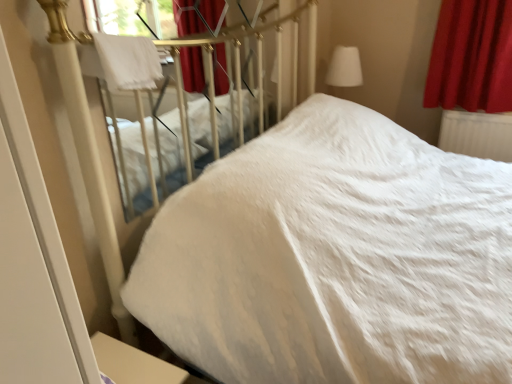
Find the location of a particular element. Image resolution: width=512 pixels, height=384 pixels. velvet red curtain at upper right is located at coordinates (472, 57).

What is the approximate width of white fabric lampshade at upper right?

white fabric lampshade at upper right is 28.93 centimeters wide.

This screenshot has width=512, height=384. What are the coordinates of `white soft bed at center, which appears as the second bed when viewed from the left` in the screenshot? It's located at (334, 258).

The height and width of the screenshot is (384, 512). Find the location of `white glossy screen door at lower left`. white glossy screen door at lower left is located at coordinates (38, 253).

Could you tell me if white soft bed at upper left, the second bed viewed from the right, is turned towards white soft bed at center, which appears as the second bed when viewed from the left?

Yes, white soft bed at upper left, the second bed viewed from the right, is turned towards white soft bed at center, which appears as the second bed when viewed from the left.

In terms of size, does white soft bed at upper left, which appears as the 1th bed when viewed from the left, appear bigger or smaller than white soft bed at center, the first bed in the right-to-left sequence?

Clearly, white soft bed at upper left, which appears as the 1th bed when viewed from the left, is smaller in size than white soft bed at center, the first bed in the right-to-left sequence.

Looking at this image, is white soft bed at upper left, which appears as the 1th bed when viewed from the left, to the left of white soft bed at center, the first bed in the right-to-left sequence, from the viewer's perspective?

Yes, white soft bed at upper left, which appears as the 1th bed when viewed from the left, is to the left of white soft bed at center, the first bed in the right-to-left sequence.

Which is more to the left, white soft bed at center, which appears as the second bed when viewed from the left, or white fluffy blanket at upper left?

white fluffy blanket at upper left.

Is white soft bed at center, the first bed in the right-to-left sequence, closer to the viewer compared to white fluffy blanket at upper left?

Yes, the depth of white soft bed at center, the first bed in the right-to-left sequence, is less than that of white fluffy blanket at upper left.

Which object is thinner, white soft bed at center, which appears as the second bed when viewed from the left, or white fluffy blanket at upper left?

Thinner between the two is white fluffy blanket at upper left.

Is white soft bed at center, which appears as the second bed when viewed from the left, looking in the opposite direction of white fluffy blanket at upper left?

That's right, white soft bed at center, which appears as the second bed when viewed from the left, is facing away from white fluffy blanket at upper left.

How distant is white soft bed at center, the first bed in the right-to-left sequence, from white soft bed at upper left, which appears as the 1th bed when viewed from the left?

The distance of white soft bed at center, the first bed in the right-to-left sequence, from white soft bed at upper left, which appears as the 1th bed when viewed from the left, is 27.78 inches.

From a real-world perspective, is white soft bed at center, which appears as the second bed when viewed from the left, beneath white soft bed at upper left, the second bed viewed from the right?

Yes, from a real-world perspective, white soft bed at center, which appears as the second bed when viewed from the left, is under white soft bed at upper left, the second bed viewed from the right.

Is white soft bed at center, which appears as the second bed when viewed from the left, thinner than white soft bed at upper left, which appears as the 1th bed when viewed from the left?

No.

Between white soft bed at center, the first bed in the right-to-left sequence, and white soft bed at upper left, which appears as the 1th bed when viewed from the left, which one has more height?

With more height is white soft bed at center, the first bed in the right-to-left sequence.

Considering the sizes of white soft bed at center, the first bed in the right-to-left sequence, and white plastic radiator at right in the image, is white soft bed at center, the first bed in the right-to-left sequence, wider or thinner than white plastic radiator at right?

Clearly, white soft bed at center, the first bed in the right-to-left sequence, has more width compared to white plastic radiator at right.

From a real-world perspective, is white soft bed at center, which appears as the second bed when viewed from the left, on white plastic radiator at right?

Yes, from a real-world perspective, white soft bed at center, which appears as the second bed when viewed from the left, is on top of white plastic radiator at right.

Relative to white plastic radiator at right, is white soft bed at center, the first bed in the right-to-left sequence, in front or behind?

white soft bed at center, the first bed in the right-to-left sequence, is in front of white plastic radiator at right.

Based on their positions, is white soft bed at center, the first bed in the right-to-left sequence, located to the left or right of white plastic radiator at right?

Clearly, white soft bed at center, the first bed in the right-to-left sequence, is on the left of white plastic radiator at right in the image.

Looking at this image, what's the angular difference between white fabric lampshade at upper right and white plastic radiator at right's facing directions?

The angular difference between white fabric lampshade at upper right and white plastic radiator at right is 88.6 degrees.

Could white plastic radiator at right be considered to be inside white fabric lampshade at upper right?

No, white fabric lampshade at upper right does not contain white plastic radiator at right.

You are a GUI agent. You are given a task and a screenshot of the screen. Output one action in this format:
    pyautogui.click(x=<x>, y=<y>)
    Task: Click on the table lamp above the white plastic radiator at right (from the image's perspective)
    This screenshot has width=512, height=384.
    Given the screenshot: What is the action you would take?
    pyautogui.click(x=345, y=67)

Can you confirm if white fabric lampshade at upper right is shorter than white plastic radiator at right?

Incorrect, the height of white fabric lampshade at upper right does not fall short of that of white plastic radiator at right.

Between white plastic radiator at right and white glossy screen door at lower left, which one has smaller size?

Smaller between the two is white glossy screen door at lower left.

Measure the distance between white plastic radiator at right and white glossy screen door at lower left.

white plastic radiator at right and white glossy screen door at lower left are 8.36 feet apart.

How different are the orientations of white plastic radiator at right and white glossy screen door at lower left in degrees?

88.3 degrees.

Is white plastic radiator at right spatially inside white glossy screen door at lower left, or outside of it?

white plastic radiator at right is not inside white glossy screen door at lower left, it's outside.

Is there a large distance between velvet red curtain at upper right and white soft bed at center, the first bed in the right-to-left sequence?

That's right, there is a large distance between velvet red curtain at upper right and white soft bed at center, the first bed in the right-to-left sequence.

Is velvet red curtain at upper right in front of white soft bed at center, the first bed in the right-to-left sequence?

No, the depth of velvet red curtain at upper right is greater than that of white soft bed at center, the first bed in the right-to-left sequence.

Is point (424, 98) closer or farther from the camera than point (389, 127)?

Point (424, 98).

Where is `bed that appears on the right of white soft bed at upper left, which appears as the 1th bed when viewed from the left`? The height and width of the screenshot is (384, 512). bed that appears on the right of white soft bed at upper left, which appears as the 1th bed when viewed from the left is located at coordinates (334, 258).

You are a GUI agent. You are given a task and a screenshot of the screen. Output one action in this format:
    pyautogui.click(x=<x>, y=<y>)
    Task: Click on the bed lying in front of the white fluffy blanket at upper left
    Image resolution: width=512 pixels, height=384 pixels.
    Given the screenshot: What is the action you would take?
    pyautogui.click(x=334, y=258)

Considering their positions, is white soft bed at center, the first bed in the right-to-left sequence, positioned closer to white glossy screen door at lower left than white soft bed at upper left, which appears as the 1th bed when viewed from the left?

white soft bed at center, the first bed in the right-to-left sequence, is closer to white glossy screen door at lower left.

Looking at the image, which one is located closer to white glossy screen door at lower left, white fabric lampshade at upper right or white fluffy blanket at upper left?

white fluffy blanket at upper left lies closer to white glossy screen door at lower left than the other object.

Considering their positions, is white fabric lampshade at upper right positioned further to white soft bed at center, which appears as the second bed when viewed from the left, than white plastic radiator at right?

Among the two, white fabric lampshade at upper right is located further to white soft bed at center, which appears as the second bed when viewed from the left.

From the image, which object appears to be farther from white glossy screen door at lower left, white plastic radiator at right or velvet red curtain at upper right?

Among the two, white plastic radiator at right is located further to white glossy screen door at lower left.

Estimate the real-world distances between objects in this image. Which object is closer to white plastic radiator at right, white glossy screen door at lower left or white fluffy blanket at upper left?

The object closer to white plastic radiator at right is white fluffy blanket at upper left.

Looking at the image, which one is located closer to white soft bed at center, the first bed in the right-to-left sequence, velvet red curtain at upper right or white soft bed at upper left, the second bed viewed from the right?

Among the two, white soft bed at upper left, the second bed viewed from the right, is located nearer to white soft bed at center, the first bed in the right-to-left sequence.

Based on their spatial positions, is white fabric lampshade at upper right or white glossy screen door at lower left further from white fluffy blanket at upper left?

white fabric lampshade at upper right is further to white fluffy blanket at upper left.

Considering their positions, is velvet red curtain at upper right positioned further to white soft bed at upper left, the second bed viewed from the right, than white fluffy blanket at upper left?

Based on the image, velvet red curtain at upper right appears to be further to white soft bed at upper left, the second bed viewed from the right.

At what (x,y) coordinates should I click in order to perform the action: click on bed between white soft bed at center, the first bed in the right-to-left sequence, and white plastic radiator at right, along the z-axis. Please return your answer as a coordinate pair (x, y). The width and height of the screenshot is (512, 384). Looking at the image, I should click on (194, 102).

Find the location of a particular element. This screenshot has height=384, width=512. blanket between white soft bed at upper left, the second bed viewed from the right, and white glossy screen door at lower left in the up-down direction is located at coordinates (128, 61).

Locate an element on the screen. The width and height of the screenshot is (512, 384). blanket between white glossy screen door at lower left and white plastic radiator at right in the horizontal direction is located at coordinates (128, 61).

Locate an element on the screen. The image size is (512, 384). bed positioned between white soft bed at center, which appears as the second bed when viewed from the left, and velvet red curtain at upper right from near to far is located at coordinates (194, 102).